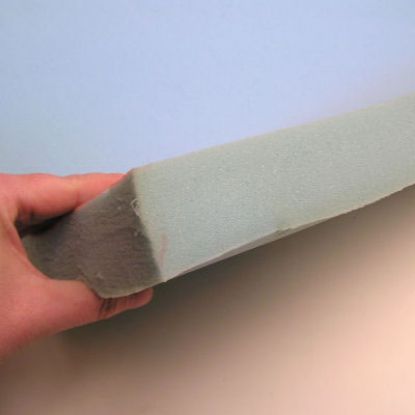
Locate an element on the screen. The image size is (415, 415). tan part of the wall is located at coordinates pos(256,359).